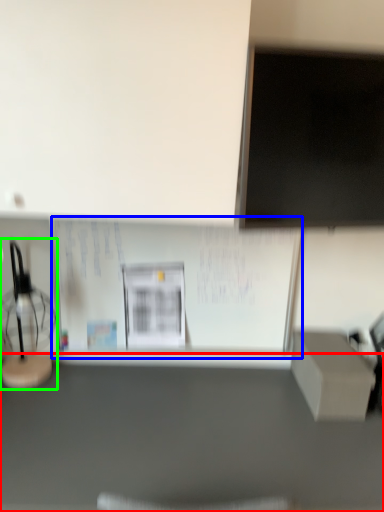
Question: Which object is positioned closest to furniture (highlighted by a red box)? Select from bulletin board (highlighted by a blue box) and table lamp (highlighted by a green box).

Choices:
 (A) bulletin board
 (B) table lamp

Answer: (A)